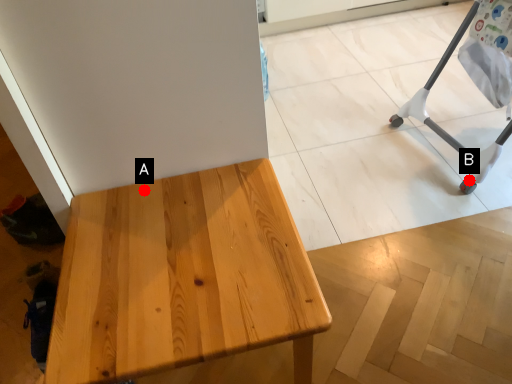
Question: Two points are circled on the image, labeled by A and B beside each circle. Which of the following is the closest to the observer?

Choices:
 (A) A is closer
 (B) B is closer

Answer: (A)